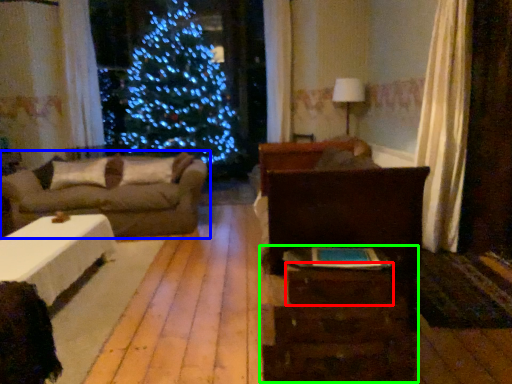
Question: Based on their relative distances, which object is farther from drawer (highlighted by a red box)? Choose from studio couch (highlighted by a blue box) and dresser (highlighted by a green box).

Choices:
 (A) studio couch
 (B) dresser

Answer: (A)